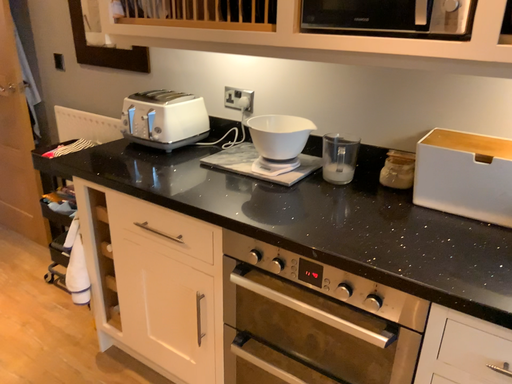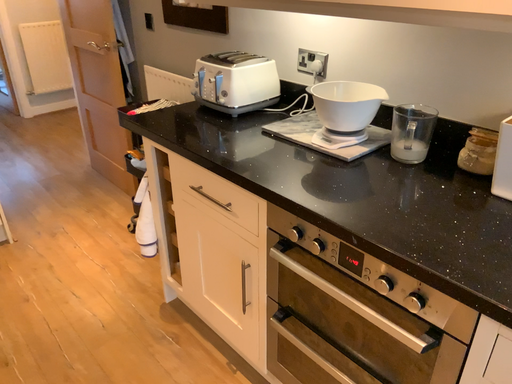
Question: How did the camera likely rotate when shooting the video?

Choices:
 (A) rotated right
 (B) rotated left

Answer: (B)